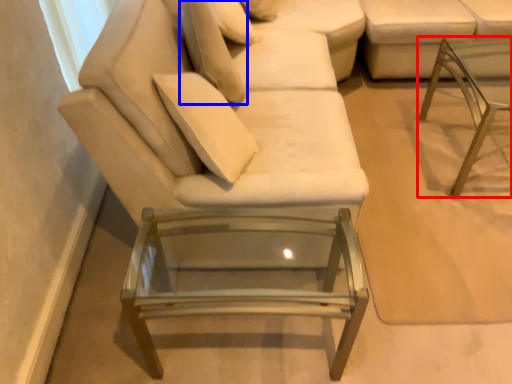
Question: Which object appears closest to the camera in this image, table (highlighted by a red box) or pillow (highlighted by a blue box)?

Choices:
 (A) table
 (B) pillow

Answer: (A)